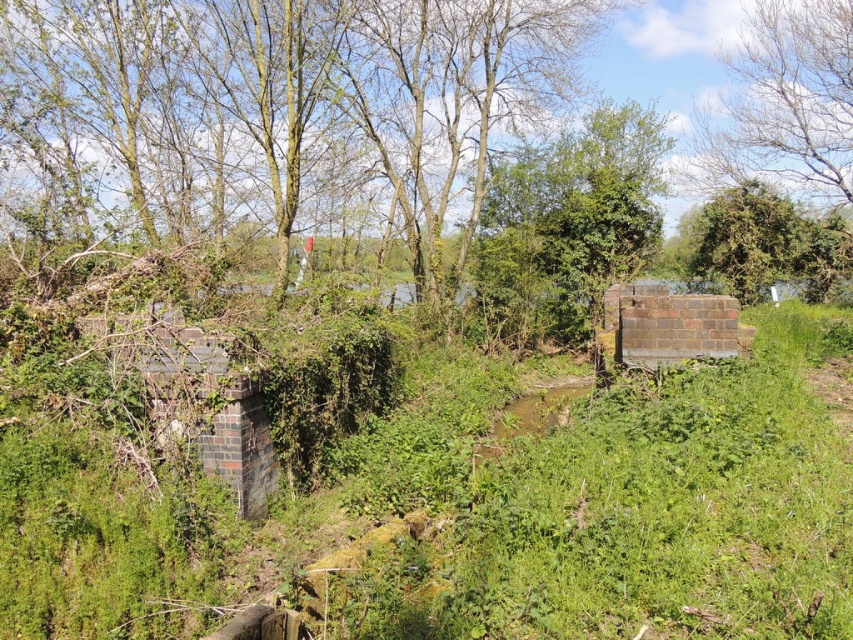
You are standing in the overgrown area near the old brick structure. You need to place a small marker exactly at the center of the image. Where should you place it relative to the green leafy grass at center?

The green leafy grass at center is located at coordinates point (x=613, y=502), so you should place the marker at that exact position relative to the green leafy grass at center.

You are standing at the point marked as point (556, 211) and want to move to the point marked as point (184, 566). Which direction should you move to get closer to your destination?

You should move towards the direction where point (184, 566) is closer than point (556, 211), so move towards the lower right direction.

You are standing at the point labeled as point (613,502) in the image. What type of terrain are you currently standing on?

You are standing on green leafy grass at center.